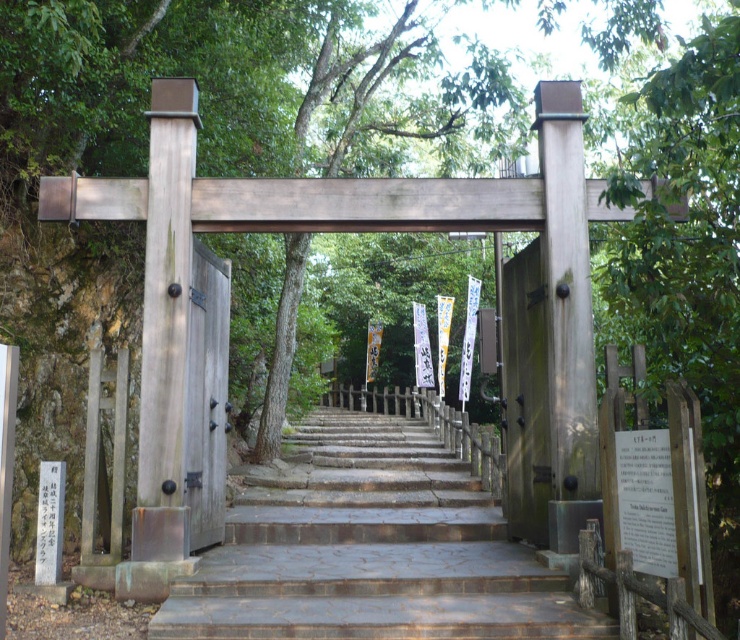
Is point (400, 472) farther from camera compared to point (188, 388)?

Yes.

Who is taller, brown stone stairs at center or wooden door at center?

With more height is wooden door at center.

Does point (289, 621) come closer to viewer compared to point (201, 310)?

That is True.

Identify the location of brown stone stairs at center. (371, 548).

In the scene shown: Can you confirm if brown stone stairs at center is positioned to the right of wooden gate at right?

No, brown stone stairs at center is not to the right of wooden gate at right.

At what (x,y) coordinates should I click in order to perform the action: click on brown stone stairs at center. Please return your answer as a coordinate pair (x, y). The width and height of the screenshot is (740, 640). Looking at the image, I should click on (371, 548).

Locate an element on the screen. Image resolution: width=740 pixels, height=640 pixels. brown stone stairs at center is located at coordinates (371, 548).

Describe the element at coordinates (525, 396) in the screenshot. I see `wooden gate at right` at that location.

How far apart are wooden gate at right and wooden door at center?

3.38 meters

Measure the distance between wooden gate at right and camera.

wooden gate at right is 7.31 meters from camera.

Where is `wooden gate at right`? The width and height of the screenshot is (740, 640). wooden gate at right is located at coordinates (525, 396).